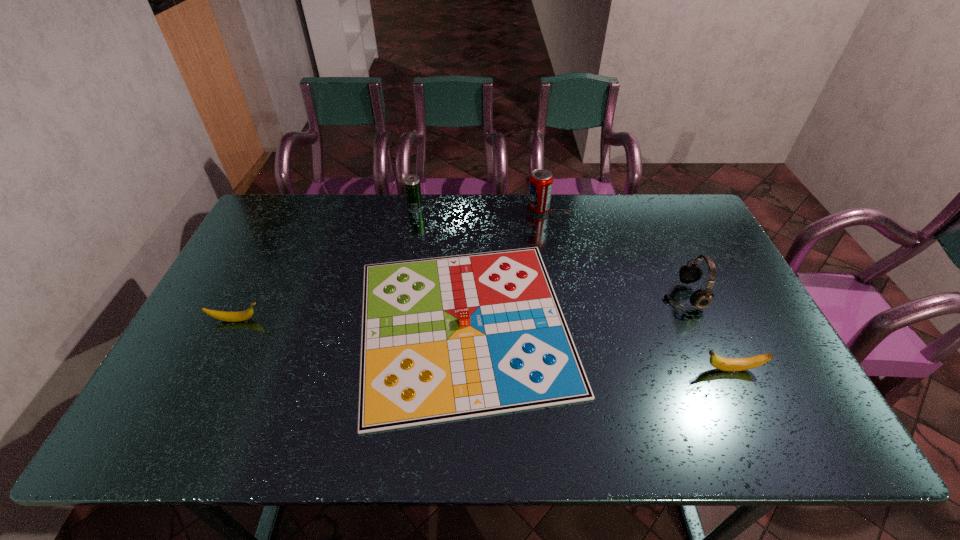
I want to click on object situated at the left edge, so click(220, 315).

Locate an element on the screen. This screenshot has width=960, height=540. headset that is at the right edge is located at coordinates (690, 273).

The image size is (960, 540). Find the location of `banana present at the right edge`. banana present at the right edge is located at coordinates (725, 364).

Locate an element on the screen. This screenshot has width=960, height=540. free spot at the far edge of the desktop is located at coordinates (336, 237).

You are a GUI agent. You are given a task and a screenshot of the screen. Output one action in this format:
    pyautogui.click(x=<x>, y=<y>)
    Task: Click on the vacant region at the left edge of the desktop
    The image size is (960, 540).
    Given the screenshot: What is the action you would take?
    pyautogui.click(x=234, y=366)

Where is `vacant region at the right edge of the desktop`? The height and width of the screenshot is (540, 960). vacant region at the right edge of the desktop is located at coordinates (717, 300).

The height and width of the screenshot is (540, 960). Identify the location of vacant region at the far left corner of the desktop. (267, 216).

This screenshot has height=540, width=960. I want to click on vacant space at the far right corner of the desktop, so click(654, 208).

Find the location of `vacant area between the soda can and the beer can`. vacant area between the soda can and the beer can is located at coordinates (476, 208).

You are a GUI agent. You are given a task and a screenshot of the screen. Output one action in this format:
    pyautogui.click(x=<x>, y=<y>)
    Task: Click on the vacant space in between the soda can and the headset
    Image resolution: width=960 pixels, height=540 pixels.
    Given the screenshot: What is the action you would take?
    pyautogui.click(x=610, y=253)